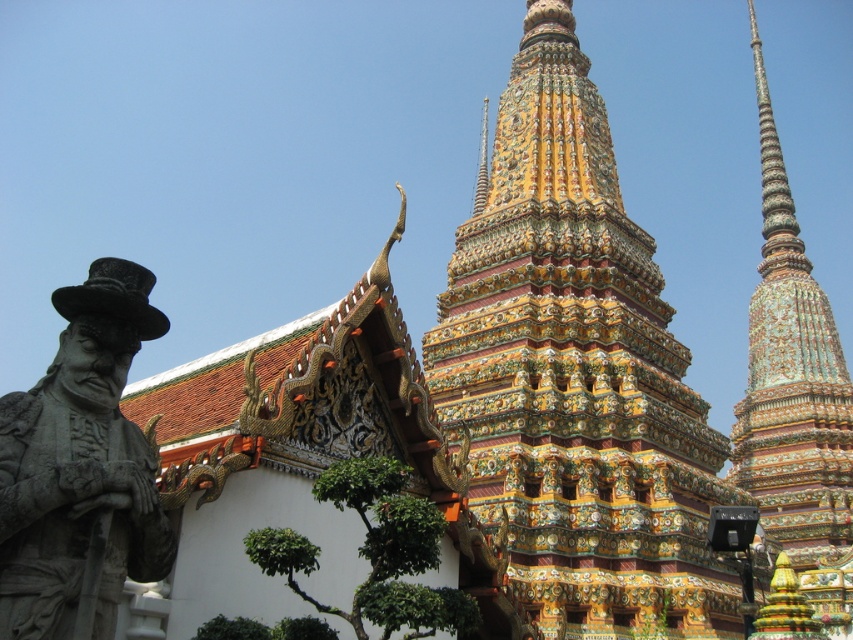
Is point (538, 448) positioned behind point (44, 460)?

Yes, point (538, 448) is farther from viewer.

The image size is (853, 640). What do you see at coordinates (576, 372) in the screenshot?
I see `multicolored mosaic temple at center` at bounding box center [576, 372].

What do you see at coordinates (576, 372) in the screenshot? The image size is (853, 640). I see `multicolored mosaic temple at center` at bounding box center [576, 372].

Where is `multicolored mosaic temple at center`? This screenshot has width=853, height=640. multicolored mosaic temple at center is located at coordinates (576, 372).

Is multicolored mosaic temple at center to the right of multicolored mosaic stupa at center from the viewer's perspective?

In fact, multicolored mosaic temple at center is to the left of multicolored mosaic stupa at center.

Consider the image. Who is more distant from viewer, (497, 300) or (837, 499)?

Positioned behind is point (837, 499).

The image size is (853, 640). Find the location of `multicolored mosaic temple at center`. multicolored mosaic temple at center is located at coordinates (576, 372).

Based on the photo, is gray stone statue at left taller than multicolored mosaic stupa at center?

In fact, gray stone statue at left may be shorter than multicolored mosaic stupa at center.

Who is taller, gray stone statue at left or multicolored mosaic stupa at center?

Standing taller between the two is multicolored mosaic stupa at center.

The width and height of the screenshot is (853, 640). Identify the location of gray stone statue at left. (80, 467).